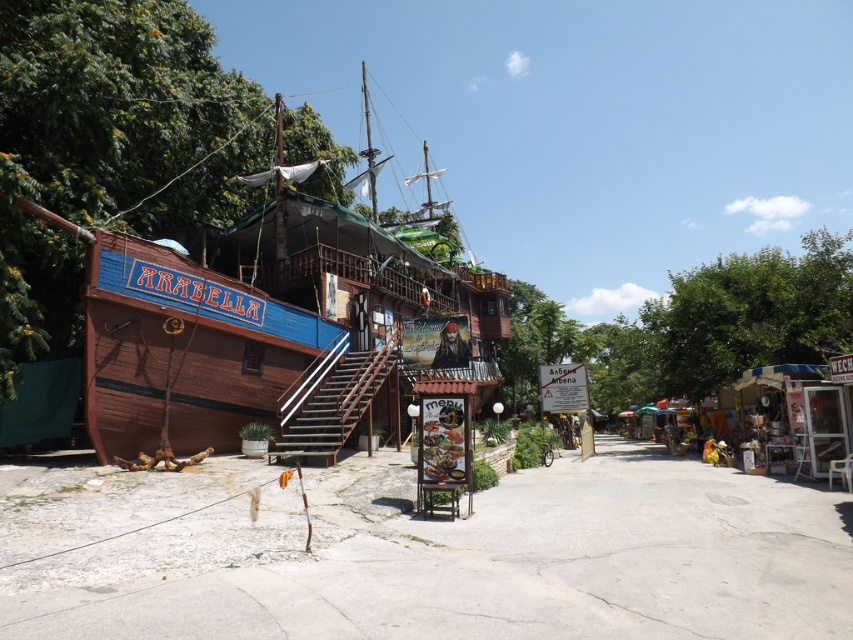
Who is more forward, (x=224, y=310) or (x=738, y=381)?

Point (x=224, y=310) is more forward.

Is wooden pirate ship at center shorter than metallic silver stall at right?

No, wooden pirate ship at center is not shorter than metallic silver stall at right.

Is point (175, 372) positioned in front of point (744, 404)?

Yes.

You are a GUI agent. You are given a task and a screenshot of the screen. Output one action in this format:
    pyautogui.click(x=<x>, y=<y>)
    Task: Click on the wooden pirate ship at center
    
    Given the screenshot: What is the action you would take?
    pyautogui.click(x=264, y=328)

Can you confirm if green leafy tree at left is wider than metallic silver stall at right?

Indeed, green leafy tree at left has a greater width compared to metallic silver stall at right.

Is point (254, 120) more distant than point (763, 401)?

Yes, point (254, 120) is behind point (763, 401).

Who is more distant from viewer, (183, 20) or (821, 381)?

Point (183, 20)

You are a GUI agent. You are given a task and a screenshot of the screen. Output one action in this format:
    pyautogui.click(x=<x>, y=<y>)
    Task: Click on the green leafy tree at left
    
    Given the screenshot: What is the action you would take?
    pyautogui.click(x=125, y=115)

Does green leafy tree at left appear under green leafy tree at upper right?

No.

Does point (196, 141) come closer to viewer compared to point (654, 333)?

Yes.

Measure the distance between point (x=50, y=273) and camera.

The distance of point (x=50, y=273) from camera is 13.24 meters.

This screenshot has height=640, width=853. In order to click on green leafy tree at left in this screenshot , I will do `click(125, 115)`.